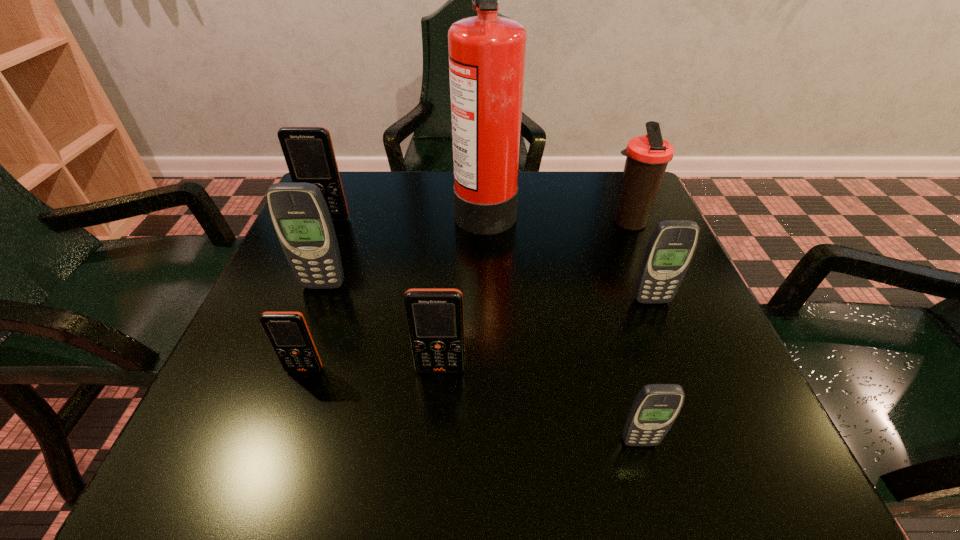
Identify the location of the fourth cellular telephone from left to right. The height and width of the screenshot is (540, 960). (435, 320).

You are a GUI agent. You are given a task and a screenshot of the screen. Output one action in this format:
    pyautogui.click(x=<x>, y=<y>)
    Task: Click on the smallest orange cellular telephone
    
    Given the screenshot: What is the action you would take?
    pyautogui.click(x=288, y=332)

Identify the location of the second cellular telephone from right to left. The height and width of the screenshot is (540, 960). (655, 408).

Locate an element on the screen. the nearest object is located at coordinates (655, 408).

You are a GUI agent. You are given a task and a screenshot of the screen. Output one action in this format:
    pyautogui.click(x=<x>, y=<y>)
    Task: Click on the free space located 0.230m on the front-facing side of the fire extinguisher
    
    Given the screenshot: What is the action you would take?
    pyautogui.click(x=359, y=207)

I want to click on vacant region located on the front-facing side of the fire extinguisher, so click(x=343, y=207).

Find the location of `free spot located on the front-facing side of the fire extinguisher`. free spot located on the front-facing side of the fire extinguisher is located at coordinates (347, 207).

Identify the location of free space located on the front of the brown thermos bottle. The height and width of the screenshot is (540, 960). (663, 309).

The height and width of the screenshot is (540, 960). Identify the location of vacant space located 0.050m on the screen of the farthest cellular telephone. (321, 237).

Locate an element on the screen. This screenshot has width=960, height=540. blank space located 0.160m on the screen of the fourth farthest object is located at coordinates (297, 357).